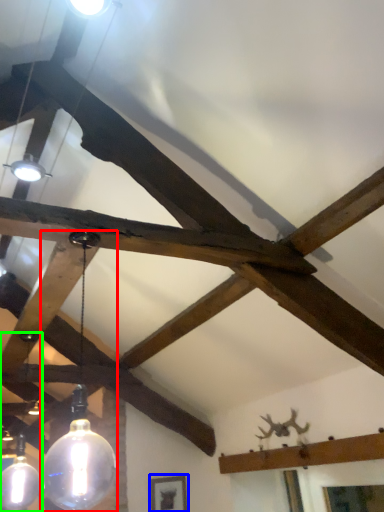
Question: Which object is positioned farthest from lamp (highlighted by a red box)? Select from picture frame (highlighted by a blue box) and lamp (highlighted by a green box).

Choices:
 (A) picture frame
 (B) lamp

Answer: (A)